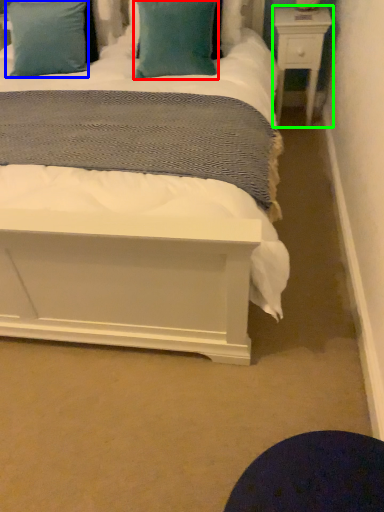
Question: Which object is the closest to the pillow (highlighted by a red box)? Choose among these: pillow (highlighted by a blue box) or nightstand (highlighted by a green box).

Choices:
 (A) pillow
 (B) nightstand

Answer: (A)